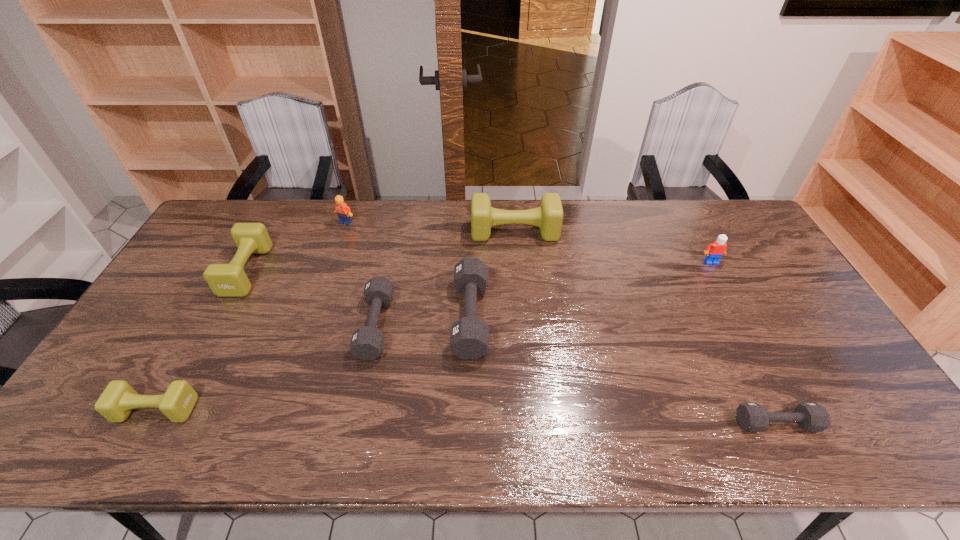
Identify which dumbbell is the fourth closest to the biggest gray dumbbell. Please provide its 2D coordinates. Your answer should be formatted as a tuple, i.e. [(x, y)], where the tuple contains the x and y coordinates of a point satisfying the conditions above.

[(225, 280)]

What are the coordinates of `dumbbell identified as the fourth closest to the right Lego` in the screenshot? It's located at (367, 343).

Where is `the second closest olive dumbbell to the orange Lego`? the second closest olive dumbbell to the orange Lego is located at coordinates (548, 217).

Locate an element on the screen. Image resolution: width=960 pixels, height=540 pixels. olive dumbbell that is the third closest to the smallest gray dumbbell is located at coordinates (225, 280).

Identify which gray dumbbell is the third closest to the second nearest olive dumbbell. Please provide its 2D coordinates. Your answer should be formatted as a tuple, i.e. [(x, y)], where the tuple contains the x and y coordinates of a point satisfying the conditions above.

[(753, 417)]

Where is `gray dumbbell that is the second nearest to the farthest dumbbell`? Image resolution: width=960 pixels, height=540 pixels. gray dumbbell that is the second nearest to the farthest dumbbell is located at coordinates (x=367, y=343).

Locate an element on the screen. The width and height of the screenshot is (960, 540). free space that satisfies the following two spatial constraints: 1. on the front-facing side of the farther Lego; 2. on the right side of the farthest olive dumbbell is located at coordinates (342, 232).

Find the location of a particular element. The image size is (960, 540). vacant space that satisfies the following two spatial constraints: 1. on the front-facing side of the third dumbbell from left to right; 2. on the right side of the orange Lego is located at coordinates (310, 326).

The image size is (960, 540). Identify the location of free spot that satisfies the following two spatial constraints: 1. on the front-facing side of the second gray dumbbell from left to right; 2. on the right side of the left Lego. (313, 317).

Where is `free space that satisfies the following two spatial constraints: 1. on the front-facing side of the orange Lego; 2. on the left side of the rightmost olive dumbbell`? free space that satisfies the following two spatial constraints: 1. on the front-facing side of the orange Lego; 2. on the left side of the rightmost olive dumbbell is located at coordinates (342, 232).